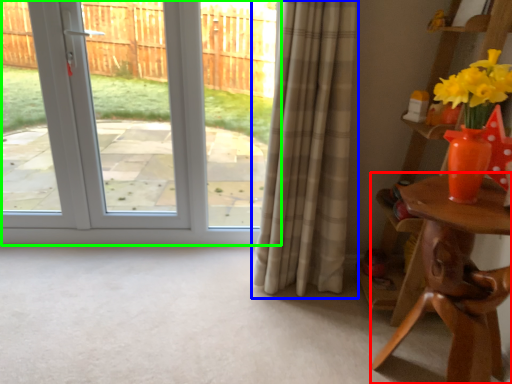
Question: Considering the real-world distances, which object is closest to table (highlighted by a red box)? curtain (highlighted by a blue box) or door (highlighted by a green box).

Choices:
 (A) curtain
 (B) door

Answer: (A)